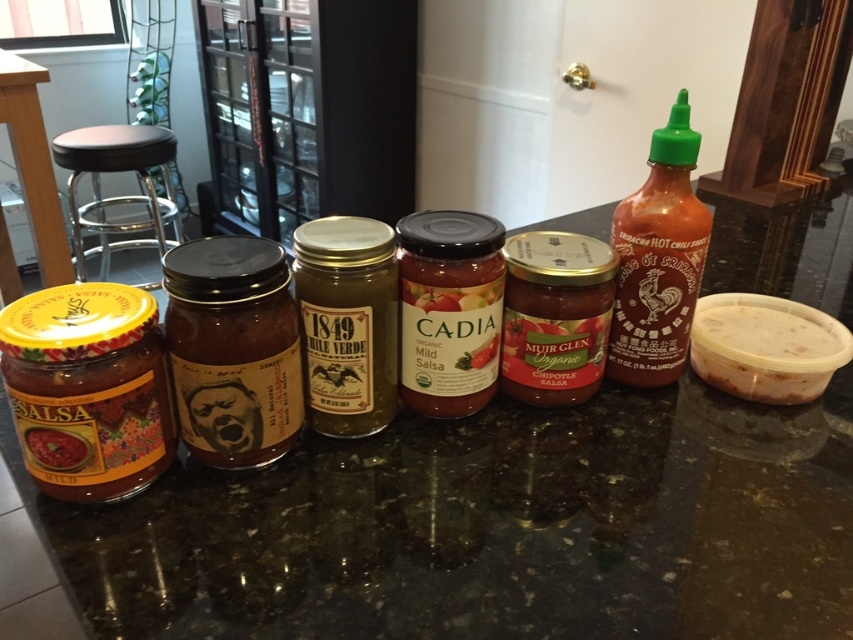
Question: Is black leather stool at left above matte glass jar at left?

Choices:
 (A) no
 (B) yes

Answer: (B)

Question: Which object appears closest to the camera in this image?

Choices:
 (A) black leather stool at left
 (B) white plastic container at right

Answer: (B)

Question: Observing the image, what is the correct spatial positioning of green plastic bottle at right in reference to white plastic container at right?

Choices:
 (A) left
 (B) right

Answer: (A)

Question: Among these points, which one is nearest to the camera?

Choices:
 (A) (48, 170)
 (B) (140, 148)
 (C) (634, 240)

Answer: (C)

Question: Which object is farther from the camera taking this photo?

Choices:
 (A) black leather stool at left
 (B) yellow plastic container at left

Answer: (A)

Question: Observing the image, what is the correct spatial positioning of green plastic bottle at right in reference to matte glass jar at left?

Choices:
 (A) below
 (B) above

Answer: (B)